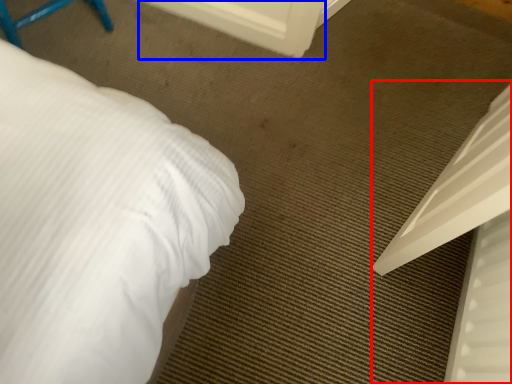
Question: Which object appears farthest to the camera in this image, bed (highlighted by a red box) or screen door (highlighted by a blue box)?

Choices:
 (A) bed
 (B) screen door

Answer: (B)